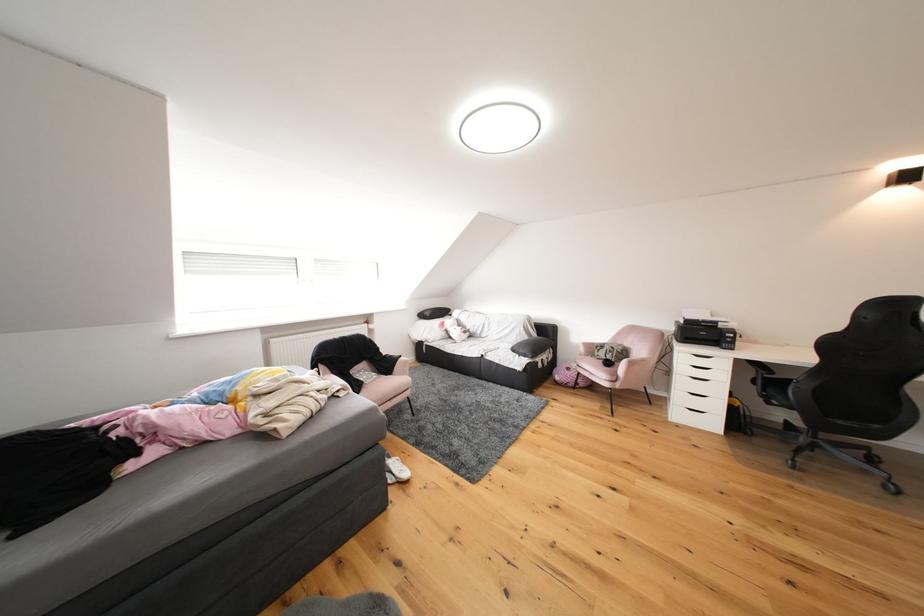
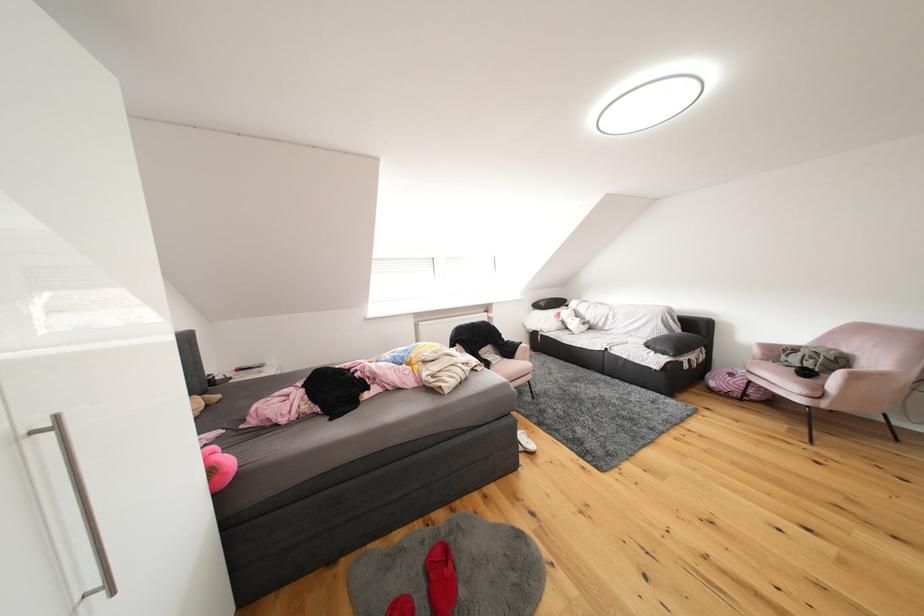
In the second image, find the point that corresponds to pixel 590 353 in the first image.

(766, 355)